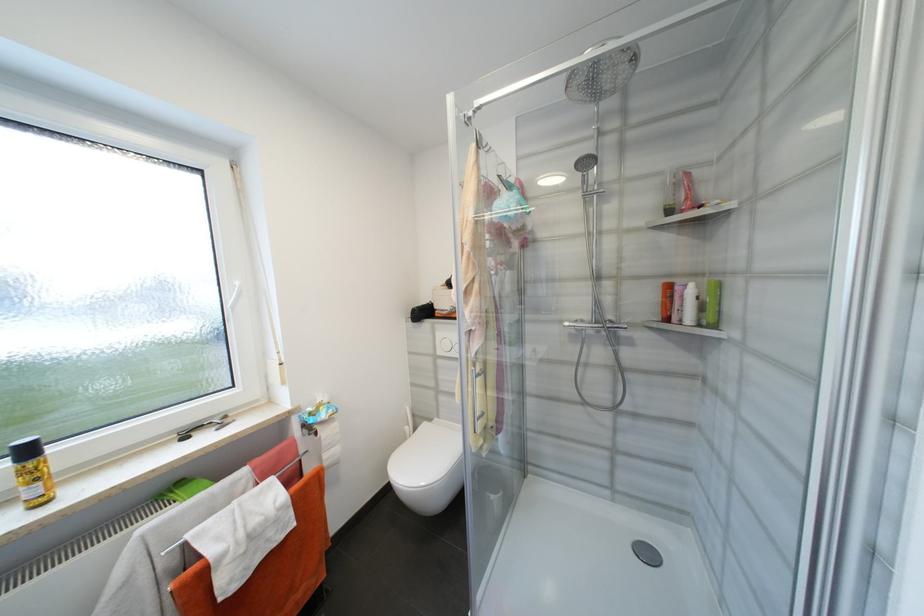
Describe the element at coordinates (581, 325) in the screenshot. Image resolution: width=924 pixels, height=616 pixels. I see `a chrome shower lever` at that location.